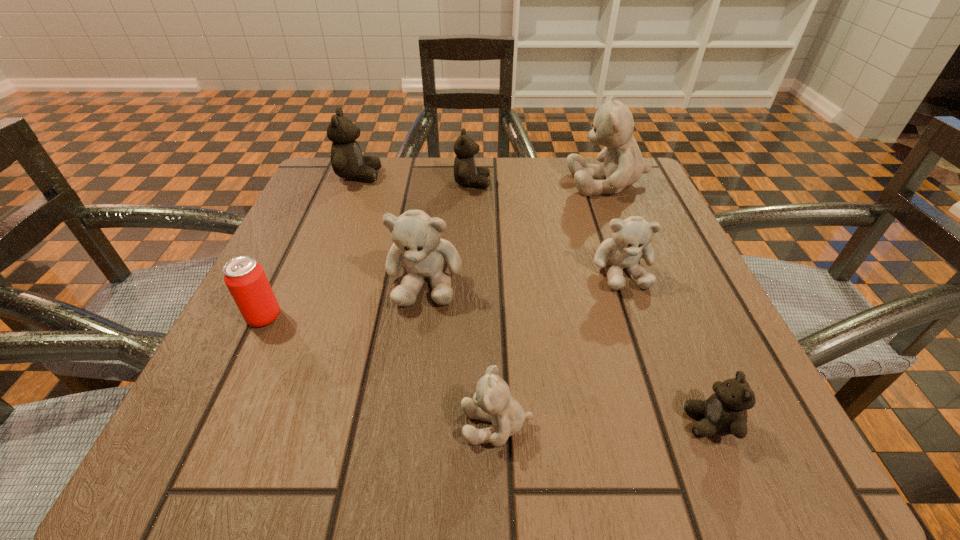
The width and height of the screenshot is (960, 540). Find the location of `object that is at the near right corner`. object that is at the near right corner is located at coordinates (725, 412).

At what (x,y) coordinates should I click in order to perform the action: click on vacant space at the far edge. Please return your answer as a coordinate pair (x, y). This screenshot has height=540, width=960. Looking at the image, I should click on (487, 208).

I want to click on blank area at the near edge, so coord(365,425).

You are a GUI agent. You are given a task and a screenshot of the screen. Output one action in this format:
    pyautogui.click(x=<x>, y=<y>)
    Task: Click on the free space at the left edge of the desktop
    
    Given the screenshot: What is the action you would take?
    pyautogui.click(x=358, y=252)

You are a GUI agent. You are given a task and a screenshot of the screen. Output one action in this format:
    pyautogui.click(x=<x>, y=<y>)
    Task: Click on the vacant area at the right edge of the desktop
    
    Given the screenshot: What is the action you would take?
    pyautogui.click(x=602, y=219)

The width and height of the screenshot is (960, 540). I want to click on free space at the near left corner of the desktop, so click(x=221, y=444).

Where is `vacant space at the far right corner of the desktop`? This screenshot has width=960, height=540. vacant space at the far right corner of the desktop is located at coordinates (635, 200).

At what (x,y) coordinates should I click in order to perform the action: click on unoccupied position between the farthest gray teddy bear and the nearest brown teddy bear. Please return your answer as a coordinate pair (x, y). This screenshot has height=540, width=960. Looking at the image, I should click on (659, 303).

At what (x,y) coordinates should I click in order to perform the action: click on empty space between the third biggest gray teddy bear and the second brown teddy bear from right to left. Please return your answer as a coordinate pair (x, y). Looking at the image, I should click on (547, 227).

Image resolution: width=960 pixels, height=540 pixels. In order to click on vacant area between the smallest brown teddy bear and the farthest gray teddy bear in this screenshot , I will do `click(659, 303)`.